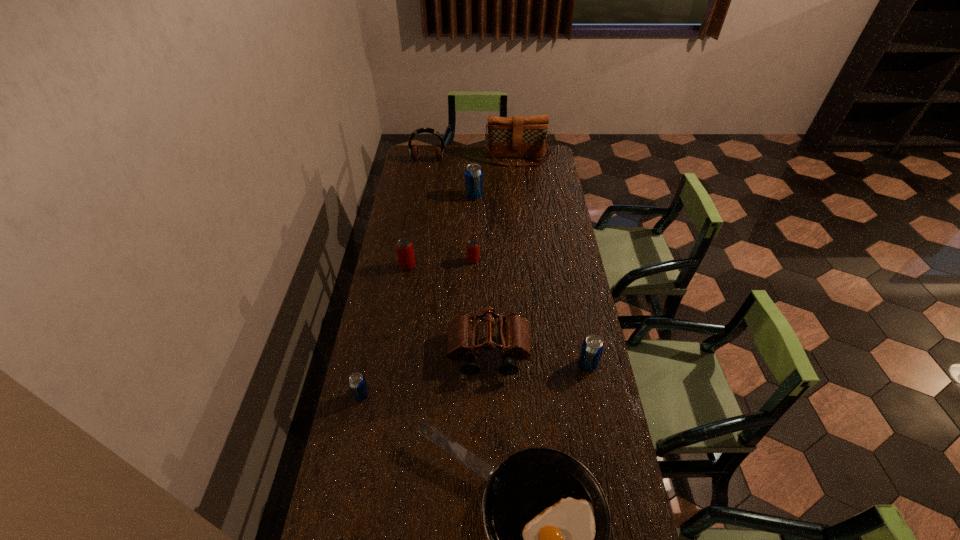
Where is `shoulder bag present at the far edge`? This screenshot has height=540, width=960. shoulder bag present at the far edge is located at coordinates (508, 137).

Identify the location of headset present at the far edge. 413,149.

I want to click on headset that is at the left edge, so click(413, 149).

Where is `shoulder bag present at the right edge`? Image resolution: width=960 pixels, height=540 pixels. shoulder bag present at the right edge is located at coordinates (508, 137).

The image size is (960, 540). In order to click on beer can that is at the right edge in this screenshot , I will do `click(592, 347)`.

Where is `object located in the far left corner section of the desktop`? Image resolution: width=960 pixels, height=540 pixels. object located in the far left corner section of the desktop is located at coordinates (413, 149).

You are a GUI agent. You are given a task and a screenshot of the screen. Output one action in this format:
    pyautogui.click(x=<x>, y=<y>)
    Task: Click on the object located at the far right corner
    
    Given the screenshot: What is the action you would take?
    pyautogui.click(x=508, y=137)

In the image, there is a desktop. Where is `free space at the far edge`? free space at the far edge is located at coordinates (456, 152).

Locate an element on the screen. This screenshot has width=960, height=540. free space at the left edge of the desktop is located at coordinates (427, 187).

Locate an element on the screen. The image size is (960, 540). vacant space at the right edge of the desktop is located at coordinates (557, 281).